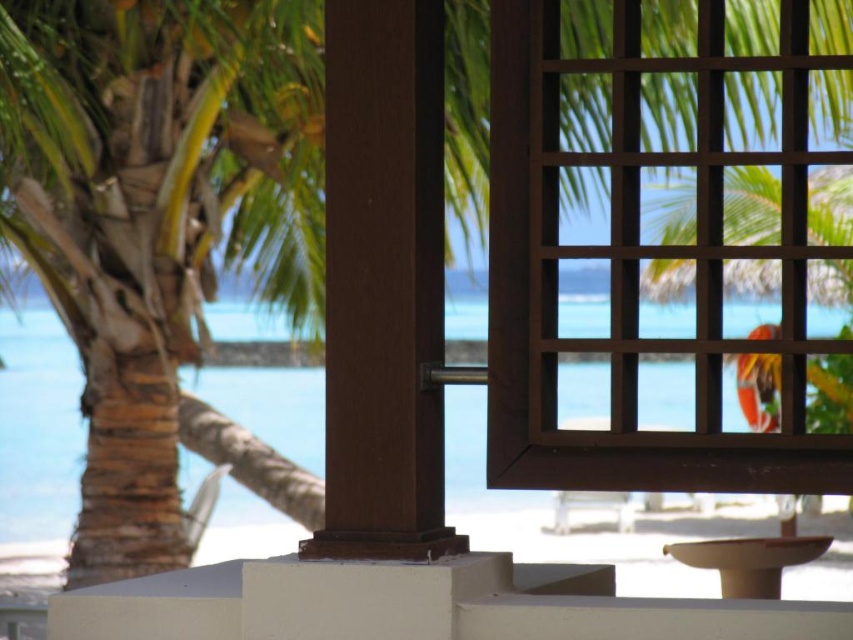
You are standing in a room and want to open the brown wooden window at upper right to let in more breeze. If you can reach up to 2 meters, will you be able to reach it?

The brown wooden window at upper right is 3.41 meters away from the camera, so you cannot reach it since your maximum reach is only 2 meters.

You are an interior designer assessing the view from a beachfront property. You notice the brown wooden window at upper right and the clear blue water at center. Which object in the scene is taller?

The brown wooden window at upper right is taller than the clear blue water at center.